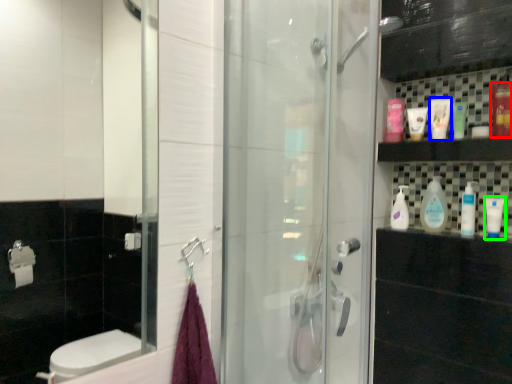
Question: Which object is positioned closest to mouthwash (highlighted by a red box)? Select from mouthwash (highlighted by a blue box) and mouthwash (highlighted by a green box).

Choices:
 (A) mouthwash
 (B) mouthwash

Answer: (A)